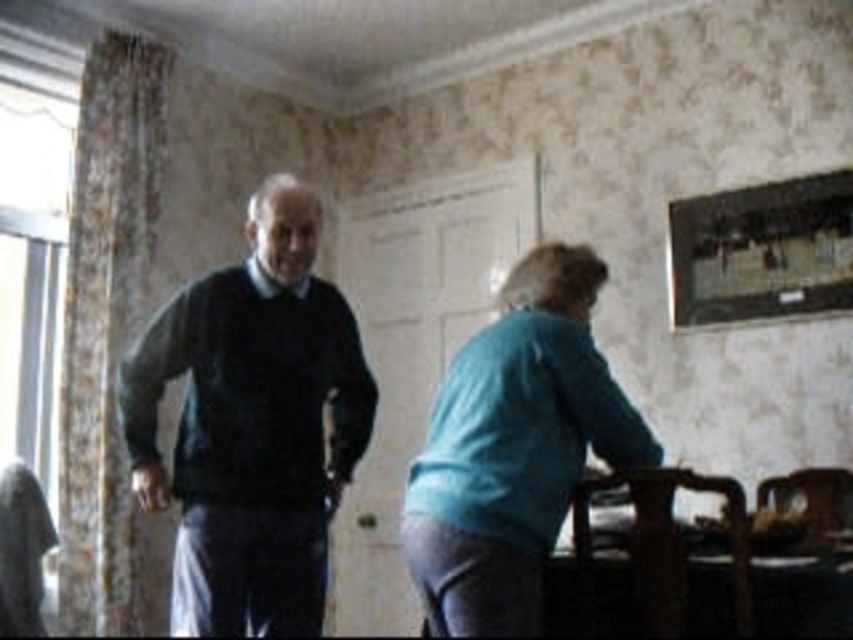
Question: Can you confirm if dark blue sweater at center is positioned above dark gray sweater at center?

Choices:
 (A) no
 (B) yes

Answer: (A)

Question: Which object is closer to the camera taking this photo?

Choices:
 (A) dark blue sweater at center
 (B) teal fabric skirt at lower right
 (C) dark gray sweater at center

Answer: (B)

Question: Can you confirm if dark gray sweater at center is positioned to the left of teal fabric skirt at lower right?

Choices:
 (A) no
 (B) yes

Answer: (B)

Question: Which object appears closest to the camera in this image?

Choices:
 (A) dark gray sweater at center
 (B) teal fabric skirt at lower right
 (C) dark blue sweater at center

Answer: (B)

Question: Is dark blue sweater at center further to the viewer compared to teal fabric skirt at lower right?

Choices:
 (A) yes
 (B) no

Answer: (A)

Question: Which point is closer to the camera?

Choices:
 (A) (422, 452)
 (B) (547, 444)

Answer: (B)